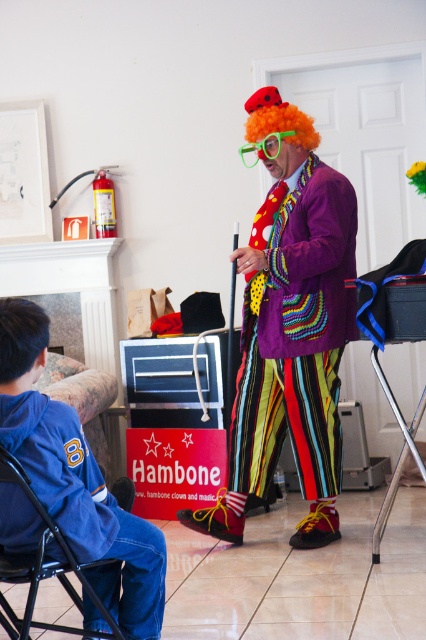
Question: Does multicolored striped pants at center appear on the left side of blue denim jacket at lower left?

Choices:
 (A) yes
 (B) no

Answer: (B)

Question: Does blue denim jacket at lower left have a greater width compared to orange curly wig at center?

Choices:
 (A) no
 (B) yes

Answer: (B)

Question: Which object appears closest to the camera in this image?

Choices:
 (A) blue fabric folding chair at lower left
 (B) blue denim jacket at lower left
 (C) multicolored striped pants at center
 (D) orange curly wig at center

Answer: (A)

Question: Estimate the real-world distances between objects in this image. Which object is closer to the orange curly wig at center?

Choices:
 (A) blue denim jacket at lower left
 (B) blue fabric folding chair at lower left
 (C) multicolored striped pants at center

Answer: (C)

Question: Which point is closer to the camera?

Choices:
 (A) blue denim jacket at lower left
 (B) blue fabric folding chair at lower left
 (C) multicolored striped pants at center
 (D) orange curly wig at center

Answer: (B)

Question: Can you confirm if blue fabric folding chair at lower left is positioned to the left of orange curly wig at center?

Choices:
 (A) no
 (B) yes

Answer: (B)